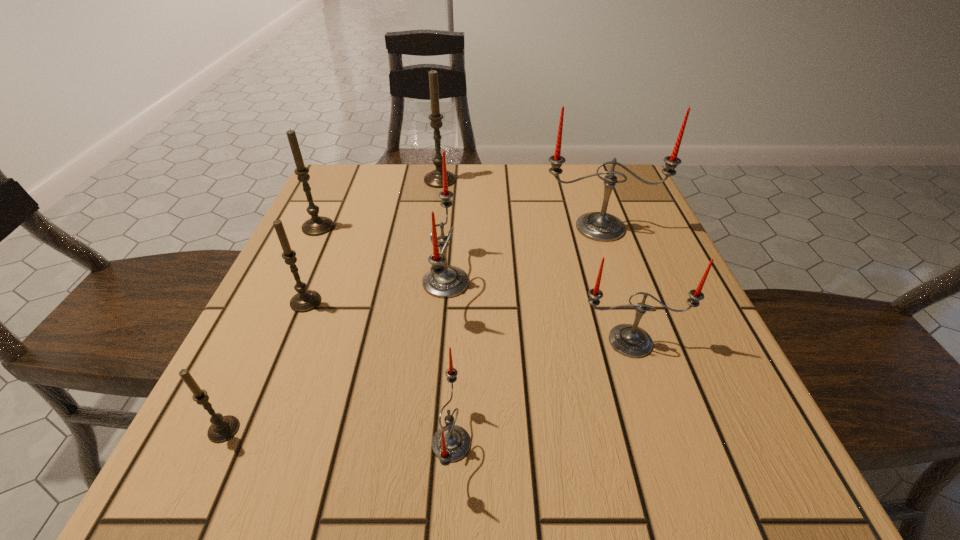
The height and width of the screenshot is (540, 960). Find the location of `empty space between the biggest red candle and the farthest object`. empty space between the biggest red candle and the farthest object is located at coordinates (520, 204).

What are the coordinates of `vacant space in between the farthest object and the nearest red candle` in the screenshot? It's located at (445, 312).

Where is `free space between the nearest red candle and the third biggest gray candle`? free space between the nearest red candle and the third biggest gray candle is located at coordinates (378, 373).

In order to click on free space between the third nearest object and the third smallest red candle in this screenshot , I will do `click(538, 312)`.

Identify the location of object that is the fourth closest one to the nearest gray candle. (317, 225).

Locate an element on the screen. The image size is (960, 540). object that stands as the second closest to the third nearest red candle is located at coordinates (599, 226).

Identify the location of candle that stands as the seventh closest to the second smallest red candle. (317, 225).

I want to click on candle that can be found as the sixth closest to the nearest gray candle, so [599, 226].

Locate which gray candle is the third closest to the smallest gray candle. Please provide its 2D coordinates. Your answer should be formatted as a tuple, i.e. [(x, y)], where the tuple contains the x and y coordinates of a point satisfying the conditions above.

[(434, 178)]

Locate an element on the screen. This screenshot has width=960, height=540. gray candle that stands as the fourth closest to the farthest red candle is located at coordinates (223, 428).